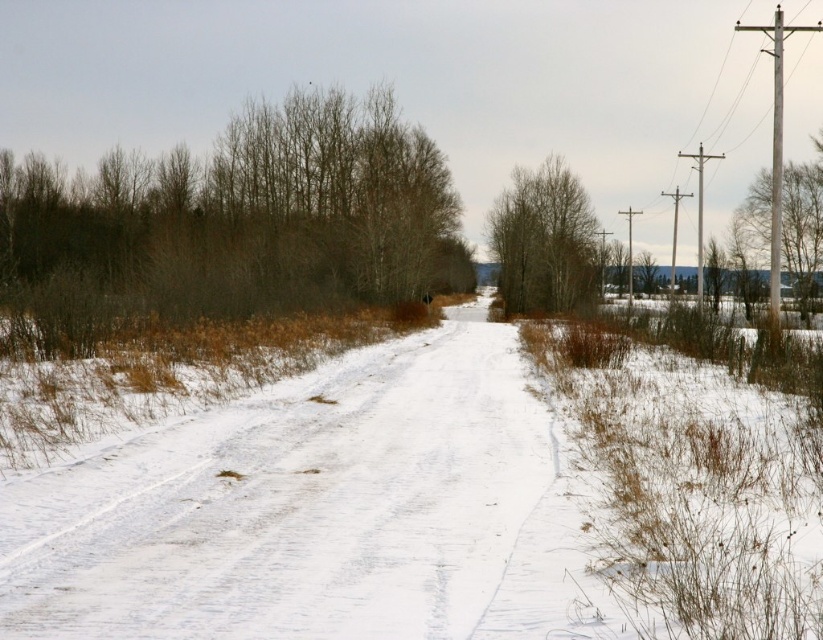
Question: Is brown/dry wood at left to the left of brown/dry wood at center from the viewer's perspective?

Choices:
 (A) yes
 (B) no

Answer: (A)

Question: In this image, where is brown/dry wood at left located relative to brown/dry wood at center?

Choices:
 (A) right
 (B) left

Answer: (B)

Question: Based on their relative distances, which object is farther from the smooth wood pole at right?

Choices:
 (A) brown/dry wood at center
 (B) brown/dry wood at left

Answer: (B)

Question: Is brown/dry wood at left smaller than brown/dry wood at center?

Choices:
 (A) yes
 (B) no

Answer: (B)

Question: Which of the following is the closest to the observer?

Choices:
 (A) (766, 182)
 (B) (152, 161)

Answer: (B)

Question: Among these points, which one is farthest from the camera?

Choices:
 (A) (350, 272)
 (B) (752, 227)

Answer: (B)